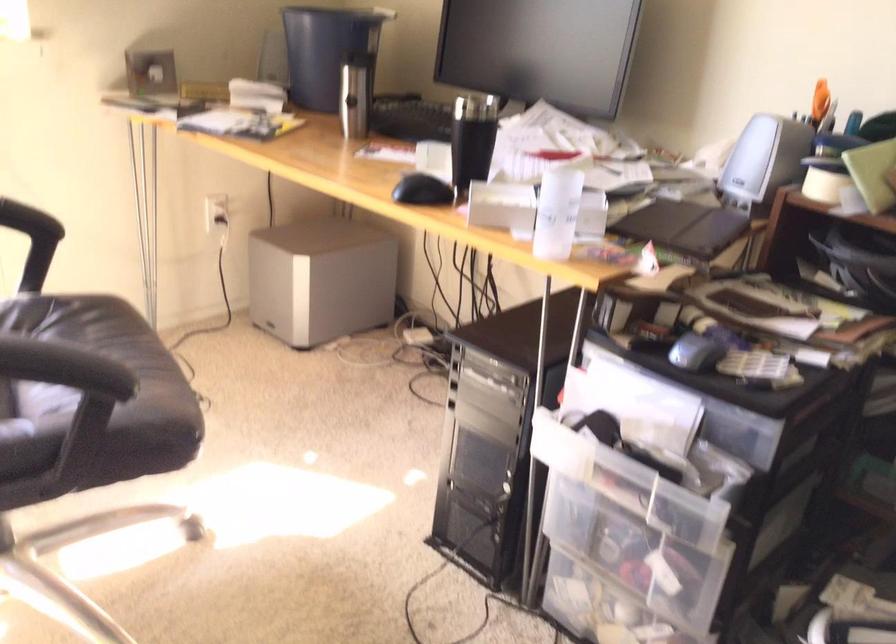
The width and height of the screenshot is (896, 644). I want to click on black travel mug, so coord(471,140).